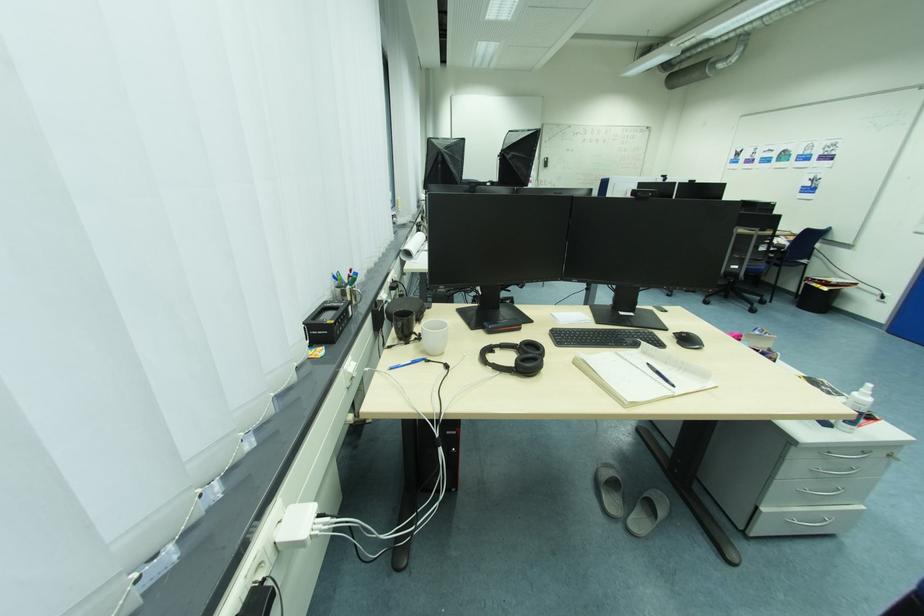
This screenshot has width=924, height=616. Describe the element at coordinates (791, 254) in the screenshot. I see `the chair sitting surface` at that location.